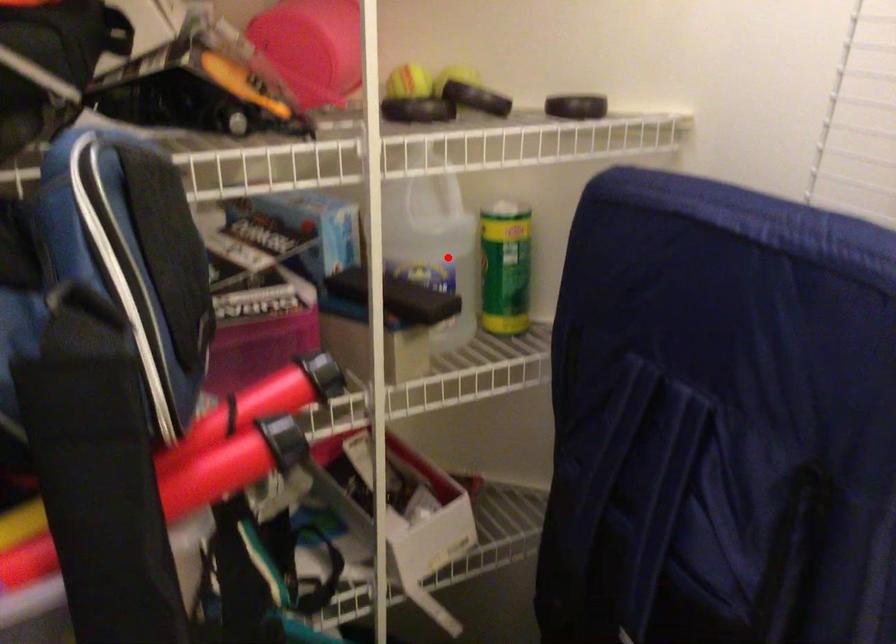
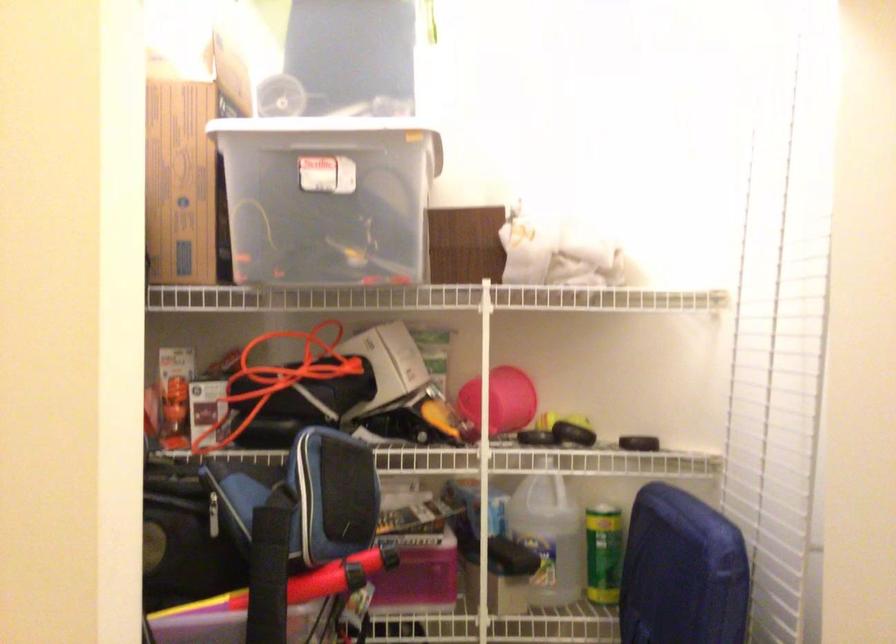
Question: I am providing you with two images of the same scene from different viewpoints. Given a red point in image1, look at the same physical point in image2. Is it:

Choices:
 (A) Closer to the viewpoint
 (B) Farther from the viewpoint

Answer: (B)